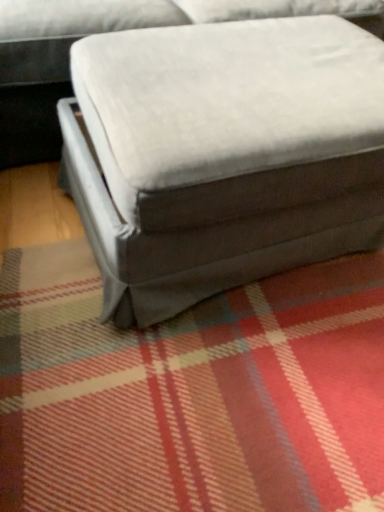
The width and height of the screenshot is (384, 512). Describe the element at coordinates (54, 63) in the screenshot. I see `velvet gray ottoman at center` at that location.

In order to face velvet gray ottoman at center, should I rotate leftwards or rightwards?

Rotate your view right by about 0.457°.

This screenshot has height=512, width=384. Find the location of `velvet gray ottoman at center`. velvet gray ottoman at center is located at coordinates (54, 63).

The width and height of the screenshot is (384, 512). Describe the element at coordinates (221, 155) in the screenshot. I see `velvet gray bean bag chair at center` at that location.

Measure the distance between point (342,36) and camera.

A distance of 1.06 meters exists between point (342,36) and camera.

Image resolution: width=384 pixels, height=512 pixels. I want to click on velvet gray bean bag chair at center, so click(x=221, y=155).

Identify the location of velvet gray ottoman at center. The height and width of the screenshot is (512, 384). (54, 63).

Between velvet gray ottoman at center and velvet gray bean bag chair at center, which one appears on the right side from the viewer's perspective?

velvet gray bean bag chair at center is more to the right.

Considering the positions of objects velvet gray ottoman at center and velvet gray bean bag chair at center in the image provided, who is behind, velvet gray ottoman at center or velvet gray bean bag chair at center?

velvet gray ottoman at center.

Is point (41, 76) closer or farther from the camera than point (338, 175)?

Point (41, 76).

From the image's perspective, is velvet gray ottoman at center on velvet gray bean bag chair at center?

Yes, from the image's perspective, velvet gray ottoman at center is above velvet gray bean bag chair at center.

Based on the photo, from a real-world perspective, which object stands above the other?

velvet gray ottoman at center.

Between velvet gray ottoman at center and velvet gray bean bag chair at center, which one has larger width?

With larger width is velvet gray ottoman at center.

Considering the relative sizes of velvet gray ottoman at center and velvet gray bean bag chair at center in the image provided, is velvet gray ottoman at center shorter than velvet gray bean bag chair at center?

No, velvet gray ottoman at center is not shorter than velvet gray bean bag chair at center.

Considering the sizes of velvet gray ottoman at center and velvet gray bean bag chair at center in the image, is velvet gray ottoman at center bigger or smaller than velvet gray bean bag chair at center?

In the image, velvet gray ottoman at center appears to be larger than velvet gray bean bag chair at center.

Is velvet gray ottoman at center outside of velvet gray bean bag chair at center?

Yes, velvet gray ottoman at center is located beyond the bounds of velvet gray bean bag chair at center.

Would you consider velvet gray ottoman at center to be distant from velvet gray bean bag chair at center?

No, velvet gray ottoman at center is not far from velvet gray bean bag chair at center.

Is velvet gray ottoman at center oriented away from velvet gray bean bag chair at center?

No, velvet gray ottoman at center's orientation is not away from velvet gray bean bag chair at center.

How different are the orientations of velvet gray ottoman at center and velvet gray bean bag chair at center in degrees?

The angle between the facing direction of velvet gray ottoman at center and the facing direction of velvet gray bean bag chair at center is 2.71 degrees.

This screenshot has width=384, height=512. Find the location of `bean bag chair on the right side of velvet gray ottoman at center`. bean bag chair on the right side of velvet gray ottoman at center is located at coordinates (221, 155).

Would you say velvet gray bean bag chair at center is to the left or to the right of velvet gray ottoman at center in the picture?

Clearly, velvet gray bean bag chair at center is on the right of velvet gray ottoman at center in the image.

Between velvet gray bean bag chair at center and velvet gray ottoman at center, which one is positioned in front?

velvet gray bean bag chair at center is closer to the camera.

Is point (286, 37) closer to viewer compared to point (32, 110)?

Yes, point (286, 37) is in front of point (32, 110).

From the image's perspective, is velvet gray bean bag chair at center positioned above or below velvet gray ottoman at center?

velvet gray bean bag chair at center is below velvet gray ottoman at center.

From a real-world perspective, relative to velvet gray ottoman at center, is velvet gray bean bag chair at center vertically above or below?

From a real-world perspective, velvet gray bean bag chair at center is physically below velvet gray ottoman at center.

Is velvet gray bean bag chair at center wider or thinner than velvet gray ottoman at center?

velvet gray bean bag chair at center is thinner than velvet gray ottoman at center.

Based on the photo, is velvet gray bean bag chair at center shorter than velvet gray ottoman at center?

Indeed, velvet gray bean bag chair at center has a lesser height compared to velvet gray ottoman at center.

In terms of size, does velvet gray bean bag chair at center appear bigger or smaller than velvet gray ottoman at center?

Considering their sizes, velvet gray bean bag chair at center takes up less space than velvet gray ottoman at center.

Consider the image. Is velvet gray ottoman at center surrounded by velvet gray bean bag chair at center?

No, velvet gray ottoman at center is not a part of velvet gray bean bag chair at center.

Are velvet gray bean bag chair at center and velvet gray ottoman at center far apart?

They are positioned close to each other.

Is velvet gray bean bag chair at center facing towards velvet gray ottoman at center?

No, velvet gray bean bag chair at center is not facing towards velvet gray ottoman at center.

How different are the orientations of velvet gray bean bag chair at center and velvet gray ottoman at center in degrees?

velvet gray bean bag chair at center and velvet gray ottoman at center are facing 2.71 degrees away from each other.

What are the coordinates of `bean bag chair below the velvet gray ottoman at center (from the image's perspective)` in the screenshot? It's located at (221, 155).

Locate an element on the screen. The height and width of the screenshot is (512, 384). studio couch that is above the velvet gray bean bag chair at center (from the image's perspective) is located at coordinates (54, 63).

Image resolution: width=384 pixels, height=512 pixels. What are the coordinates of `studio couch on the left of velvet gray bean bag chair at center` in the screenshot? It's located at (54, 63).